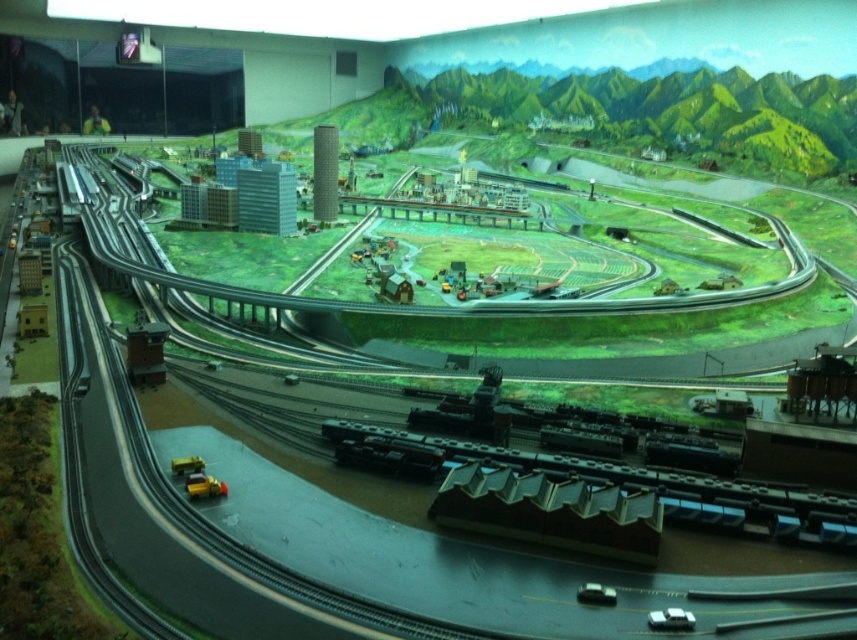
What do you see at coordinates (370, 552) in the screenshot? Image resolution: width=857 pixels, height=640 pixels. I see `metallic gray train track at center` at bounding box center [370, 552].

Does metallic gray train track at center have a greater width compared to yellow plastic car at lower left?

Correct, the width of metallic gray train track at center exceeds that of yellow plastic car at lower left.

I want to click on metallic gray train track at center, so click(x=370, y=552).

At what (x,y) coordinates should I click in order to perform the action: click on metallic gray train track at center. Please return your answer as a coordinate pair (x, y). This screenshot has width=857, height=640. Looking at the image, I should click on (370, 552).

Can you confirm if shiny silver train at bottom right is taller than yellow plastic car at lower left?

Yes.

Is shiny silver train at bottom right further to camera compared to yellow plastic car at lower left?

No, it is not.

Identify the location of shiny silver train at bottom right. Image resolution: width=857 pixels, height=640 pixels. (654, 486).

This screenshot has width=857, height=640. In order to click on shiny silver train at bottom right in this screenshot , I will do `click(654, 486)`.

Does point (559, 561) come in front of point (172, 468)?

Yes, point (559, 561) is in front of point (172, 468).

Locate an element on the screen. The width and height of the screenshot is (857, 640). metallic gray train track at center is located at coordinates (370, 552).

This screenshot has height=640, width=857. I want to click on metallic gray train track at center, so click(370, 552).